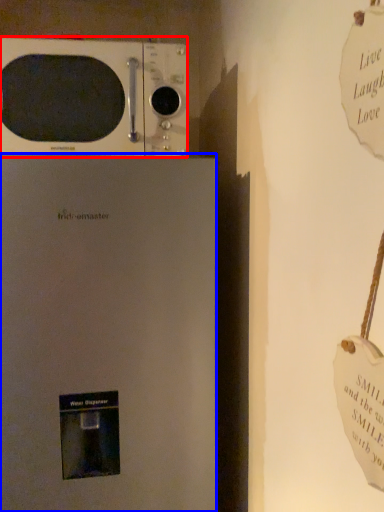
Question: Among these objects, which one is farthest to the camera, microwave oven (highlighted by a red box) or refrigerator (highlighted by a blue box)?

Choices:
 (A) microwave oven
 (B) refrigerator

Answer: (A)